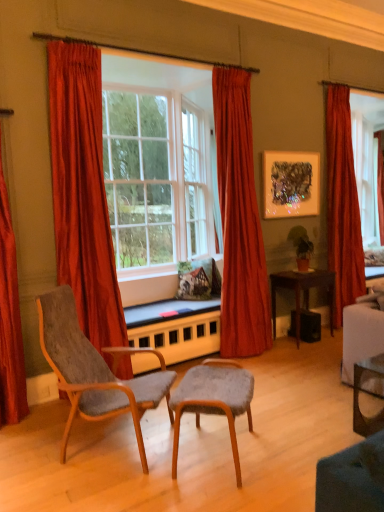
This screenshot has width=384, height=512. Identify the location of free space that is in between velvet red curtain at center, arranged as the third curtain when viewed from the left, and wooden desk at lower right, which is the first desk in back-to-front order. (277, 351).